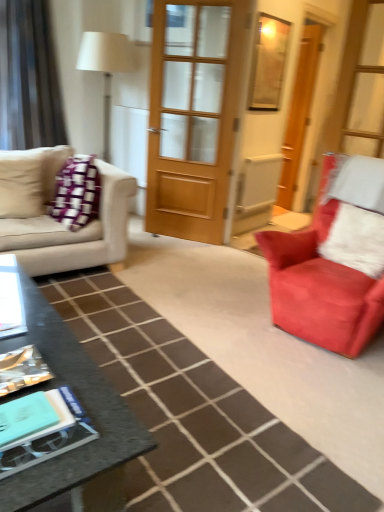
Question: Should I look upward or downward to see granite black coffee table at lower left?

Choices:
 (A) up
 (B) down

Answer: (B)

Question: Should I look upward or downward to see silky beige curtain at left?

Choices:
 (A) up
 (B) down

Answer: (A)

Question: Can you confirm if wooden door at center, the 1th door viewed from the left, is shorter than suede red armchair at right?

Choices:
 (A) no
 (B) yes

Answer: (A)

Question: From the image's perspective, does wooden door at center, which ranks as the 1th door in front-to-back order, appear higher than suede red armchair at right?

Choices:
 (A) yes
 (B) no

Answer: (A)

Question: From a real-world perspective, is wooden door at center, placed as the second door when sorted from back to front, located beneath suede red armchair at right?

Choices:
 (A) no
 (B) yes

Answer: (A)

Question: Is wooden door at center, the 2th door viewed from the right, far away from suede red armchair at right?

Choices:
 (A) no
 (B) yes

Answer: (B)

Question: Does wooden door at center, the 1th door viewed from the left, contain suede red armchair at right?

Choices:
 (A) yes
 (B) no

Answer: (B)

Question: From a real-world perspective, is wooden door at center, the 2th door viewed from the right, on top of suede red armchair at right?

Choices:
 (A) yes
 (B) no

Answer: (A)

Question: Can you confirm if granite black coffee table at lower left is thinner than white fluffy pillow at right?

Choices:
 (A) no
 (B) yes

Answer: (A)

Question: From a real-world perspective, is granite black coffee table at lower left located beneath white fluffy pillow at right?

Choices:
 (A) no
 (B) yes

Answer: (B)

Question: Is granite black coffee table at lower left oriented away from white fluffy pillow at right?

Choices:
 (A) no
 (B) yes

Answer: (B)

Question: Is the depth of granite black coffee table at lower left less than that of white fluffy pillow at right?

Choices:
 (A) no
 (B) yes

Answer: (B)

Question: Is granite black coffee table at lower left not close to white fluffy pillow at right?

Choices:
 (A) no
 (B) yes

Answer: (B)

Question: Is granite black coffee table at lower left wider than white fluffy pillow at right?

Choices:
 (A) yes
 (B) no

Answer: (A)

Question: From a real-world perspective, is smooth black coffee table at center on top of white fluffy pillow at right?

Choices:
 (A) no
 (B) yes

Answer: (A)